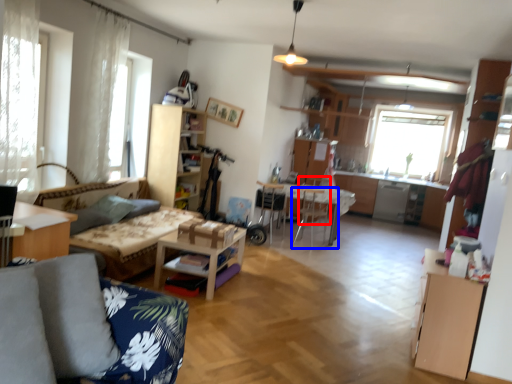
Question: Which point is further to the camera, armchair (highlighted by a red box) or chair (highlighted by a blue box)?

Choices:
 (A) armchair
 (B) chair

Answer: (A)